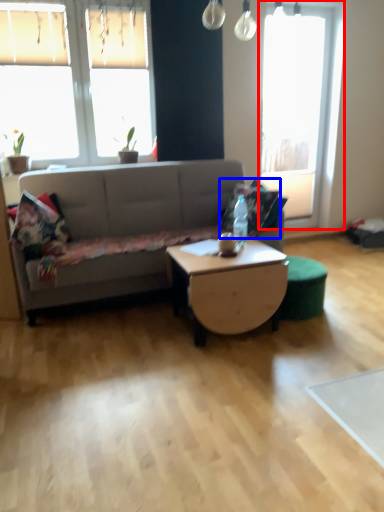
Question: Which point is further to the camera, window (highlighted by a red box) or pillow (highlighted by a blue box)?

Choices:
 (A) window
 (B) pillow

Answer: (A)